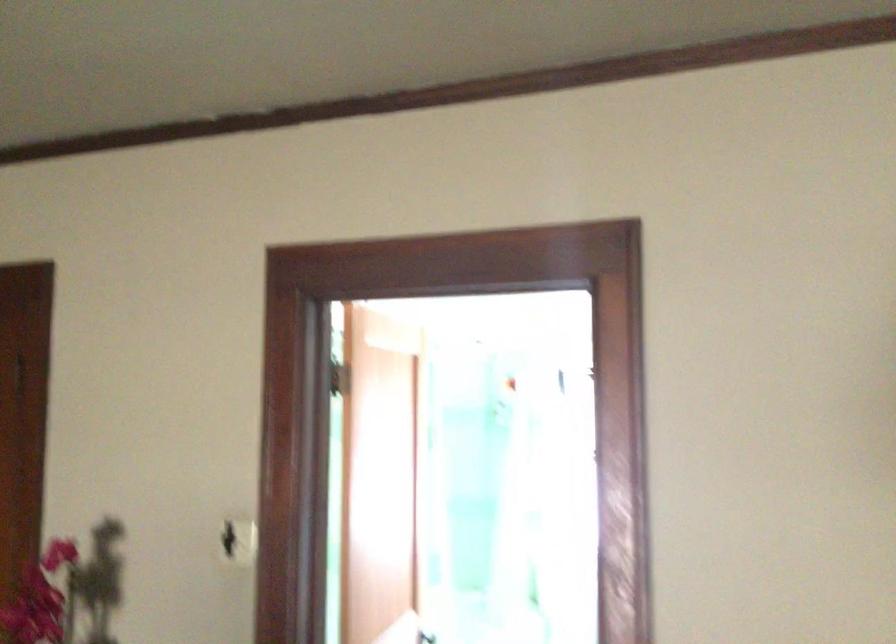
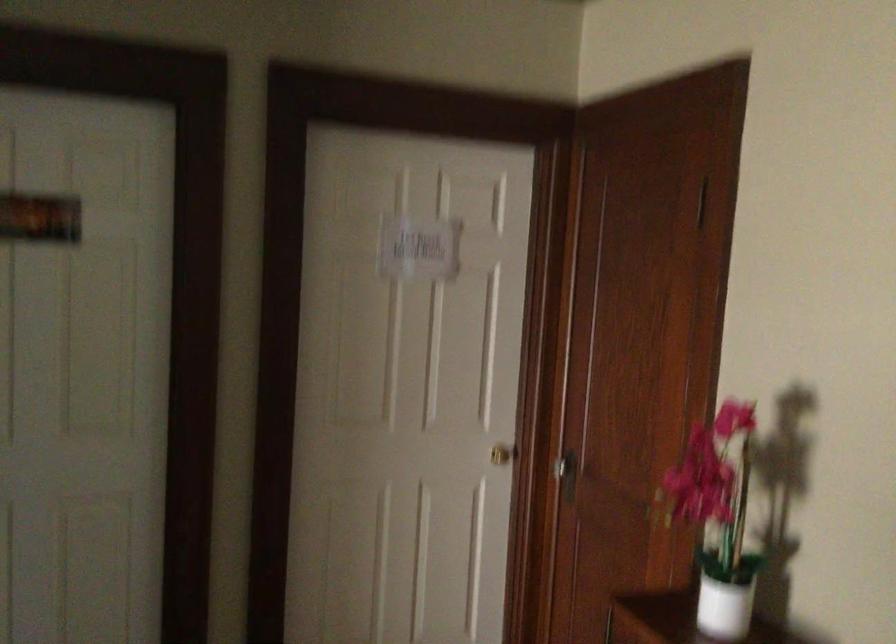
Question: The camera is either moving clockwise (left) or counter-clockwise (right) around the object. The first image is from the beginning of the video and the second image is from the end. Is the camera moving left or right when shooting the video?

Choices:
 (A) Left
 (B) Right

Answer: (B)